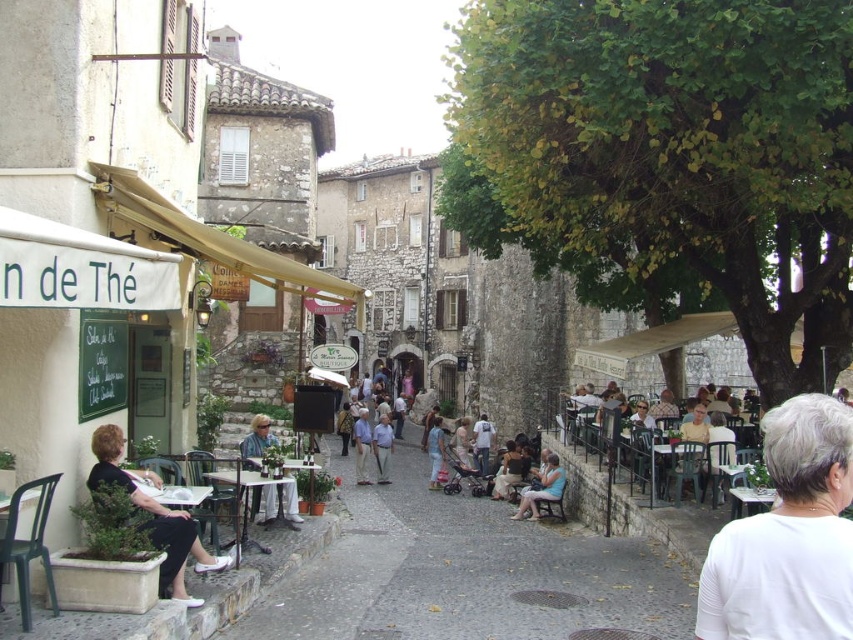
Question: Which of these objects is positioned closest to the plastic green table at center?

Choices:
 (A) light blue denim jeans at center
 (B) matte black table at center

Answer: (B)

Question: Which object is the farthest from the white matte shirt at center?

Choices:
 (A) matte white table at center
 (B) light blue shirt at center
 (C) matte black shirt at left
 (D) denim pants at center

Answer: (D)

Question: Is matte black shirt at left closer to the viewer compared to light blue denim jeans at center?

Choices:
 (A) yes
 (B) no

Answer: (A)

Question: Considering the relative positions of white matte shirt at center and matte black shirt at left in the image provided, where is white matte shirt at center located with respect to matte black shirt at left?

Choices:
 (A) right
 (B) left

Answer: (A)

Question: Is light blue fabric chair at lower center positioned behind light blue denim jeans at center?

Choices:
 (A) no
 (B) yes

Answer: (A)

Question: Which of the following is the closest to the observer?

Choices:
 (A) matte black table at center
 (B) matte white table at center

Answer: (B)